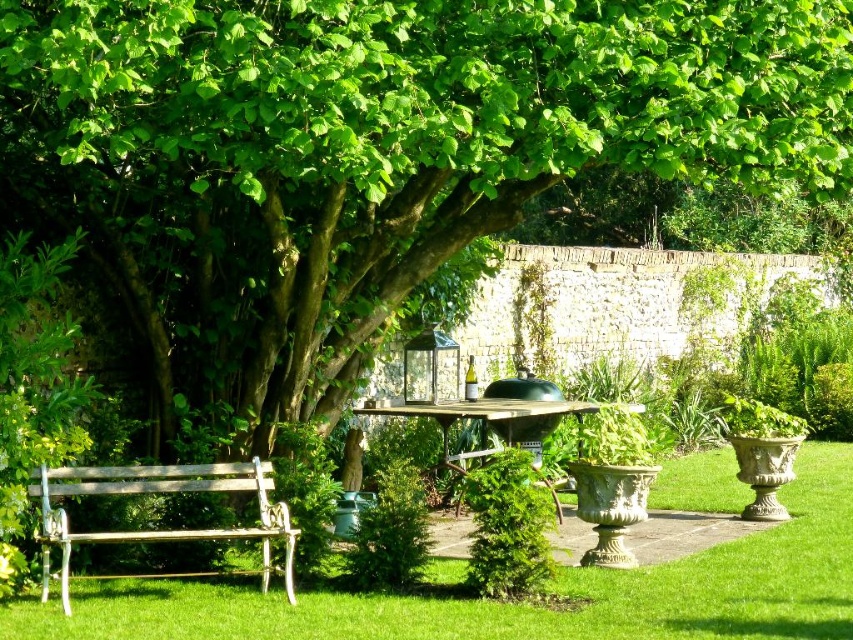
You are planning to place a new flower pot on the green grass at lower center. However, there is a smooth wooden table at center nearby. Based on their positions, which object is closer to the right edge of the garden scene?

The green grass at lower center is to the right of the smooth wooden table at center, so the green grass at lower center is closer to the right edge of the garden scene.

You are planning to set up a picnic in the garden and have a large blanket. You need to know which area is wider between the green grass at lower center and the smooth wooden table at center to choose the best spot. Which one is wider?

The green grass at lower center is wider than the smooth wooden table at center, so it is the better spot for the picnic blanket.

You are a gardener who wants to place a new flower pot on the ground near the wooden bench at lower left. Based on the scene, where should you place it so that it is on the same level as the green grass at lower center?

The green grass at lower center is below the wooden bench at lower left, so placing the flower pot on the green grass at lower center would ensure it is at the same level as the grass.